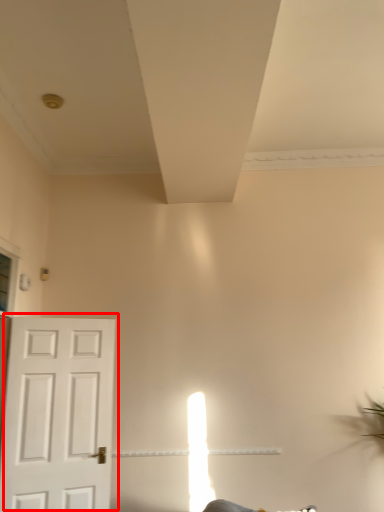
Question: Where is door (annotated by the red box) located in relation to exhaust hood in the image?

Choices:
 (A) left
 (B) right

Answer: (A)